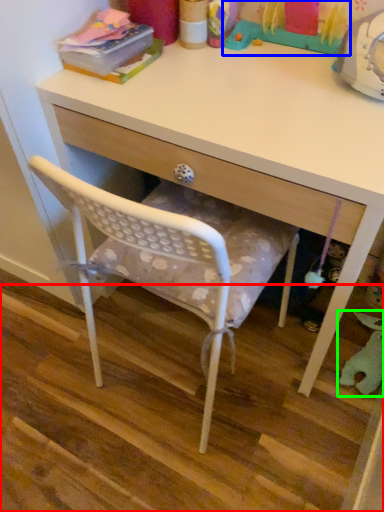
Question: Considering the real-world distances, which object is closest to stair (highlighted by a red box)? toy (highlighted by a blue box) or toy (highlighted by a green box).

Choices:
 (A) toy
 (B) toy

Answer: (B)